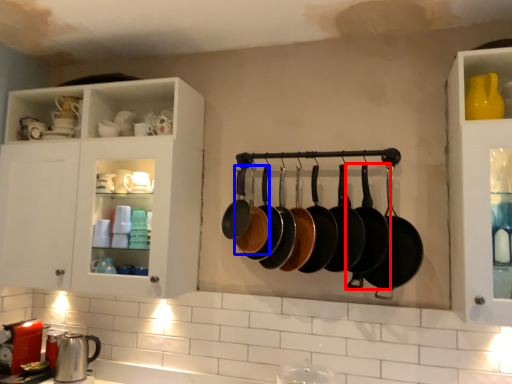
Question: Which object is closer to the camera taking this photo, frying pan (highlighted by a red box) or frying pan (highlighted by a blue box)?

Choices:
 (A) frying pan
 (B) frying pan

Answer: (A)